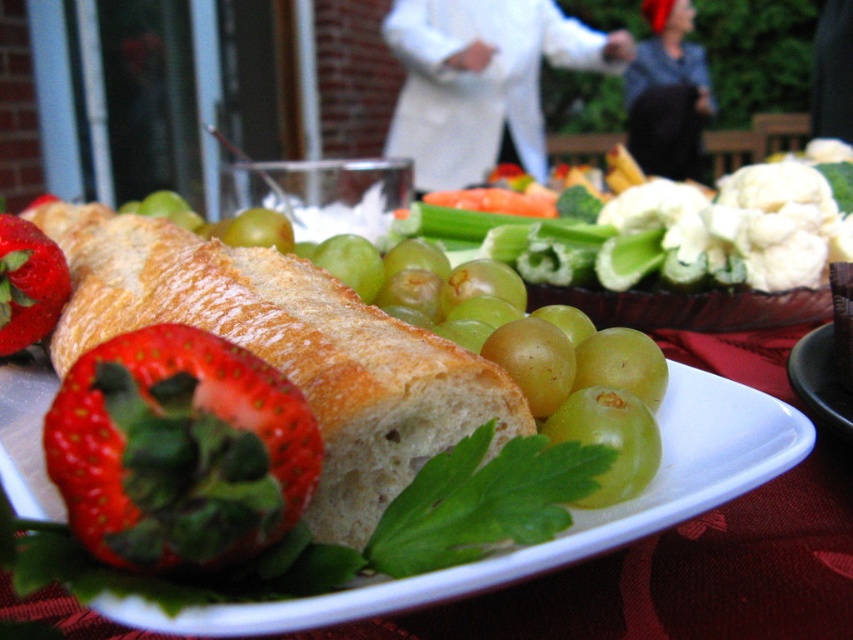
Does white fabric at upper center have a smaller size compared to shiny red strawberry at lower left?

No.

Does white fabric at upper center appear on the right side of shiny red strawberry at lower left?

Yes, white fabric at upper center is to the right of shiny red strawberry at lower left.

Where is `white fabric at upper center`? The image size is (853, 640). white fabric at upper center is located at coordinates (482, 81).

The image size is (853, 640). I want to click on white fabric at upper center, so 482,81.

From the picture: Does golden brown crusty bread at center have a greater height compared to shiny red strawberry at lower left?

Yes.

Looking at this image, who is more distant from viewer, (425, 397) or (32, 257)?

The point (32, 257) is behind.

This screenshot has width=853, height=640. Identify the location of golden brown crusty bread at center. (287, 349).

This screenshot has width=853, height=640. Find the location of `golden brown crusty bread at center`. golden brown crusty bread at center is located at coordinates (287, 349).

Does red matte strawberry at lower left have a greater height compared to white fabric at upper center?

In fact, red matte strawberry at lower left may be shorter than white fabric at upper center.

Is point (200, 568) behind point (547, 58)?

No, (200, 568) is closer to viewer.

At what (x,y) coordinates should I click in order to perform the action: click on red matte strawberry at lower left. Please return your answer as a coordinate pair (x, y). The height and width of the screenshot is (640, 853). Looking at the image, I should click on (178, 451).